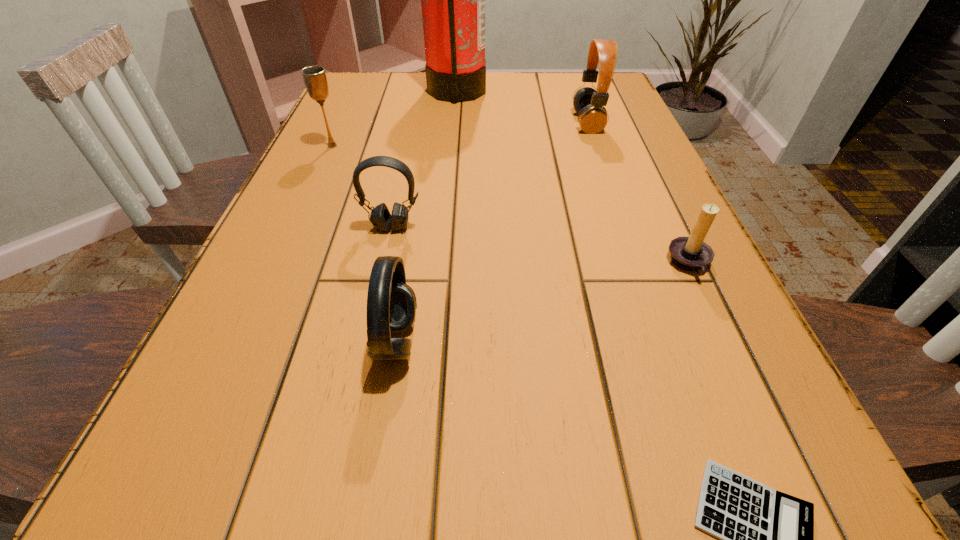
You are a GUI agent. You are given a task and a screenshot of the screen. Output one action in this format:
    pyautogui.click(x=<x>, y=<y>)
    Task: Click on the tallest object
    Image resolution: width=960 pixels, height=540 pixels.
    Given the screenshot: What is the action you would take?
    pyautogui.click(x=452, y=0)

I want to click on the rightmost headset, so click(588, 103).

Find the location of `the farthest headset`. the farthest headset is located at coordinates (588, 103).

Locate an element on the screen. Image resolution: width=960 pixels, height=540 pixels. chalice is located at coordinates (314, 77).

Identify the location of the leftmost object. (314, 77).

Locate an element on the screen. the fourth nearest object is located at coordinates (380, 217).

This screenshot has height=540, width=960. I want to click on the nearest headset, so click(391, 304).

This screenshot has width=960, height=540. In order to click on the second shortest object in this screenshot , I will do `click(690, 253)`.

Image resolution: width=960 pixels, height=540 pixels. I want to click on the fifth farthest object, so click(690, 253).

I want to click on vacant space located 0.130m on the front side of the tallest object, so click(x=532, y=92).